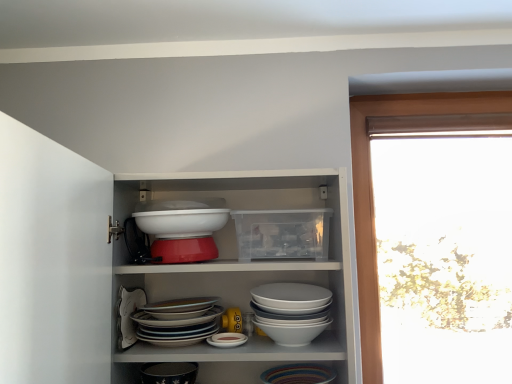
Question: Can you confirm if white glossy bowl at center, the 3th bowl in the top-to-bottom sequence, is positioned to the left of matte black bowl at lower center?

Choices:
 (A) no
 (B) yes

Answer: (A)

Question: From a real-world perspective, is white glossy bowl at center, the 3th bowl in the top-to-bottom sequence, under matte black bowl at lower center?

Choices:
 (A) no
 (B) yes

Answer: (A)

Question: Can you confirm if white glossy bowl at center, the 3th bowl in the top-to-bottom sequence, is shorter than matte black bowl at lower center?

Choices:
 (A) yes
 (B) no

Answer: (B)

Question: Does white glossy bowl at center, the 3th bowl in the top-to-bottom sequence, have a smaller size compared to matte black bowl at lower center?

Choices:
 (A) yes
 (B) no

Answer: (B)

Question: Is white glossy bowl at center, which ranks as the 1th bowl in bottom-to-top order, to the right of matte black bowl at lower center from the viewer's perspective?

Choices:
 (A) yes
 (B) no

Answer: (A)

Question: From the image's perspective, is white glossy bowl at center, which ranks as the 1th bowl in bottom-to-top order, positioned above or below white glossy bowl at center, which appears as the 3th bowl when ordered from the bottom?

Choices:
 (A) below
 (B) above

Answer: (A)

Question: Is point (222, 309) closer or farther from the camera than point (147, 223)?

Choices:
 (A) closer
 (B) farther

Answer: (B)

Question: From a real-world perspective, is white glossy bowl at center, the 3th bowl in the top-to-bottom sequence, above or below white glossy bowl at center, marked as the 1th bowl in a top-to-bottom arrangement?

Choices:
 (A) below
 (B) above

Answer: (A)

Question: Based on their positions, is white glossy bowl at center, which ranks as the 1th bowl in bottom-to-top order, located to the left or right of white glossy bowl at center, marked as the 1th bowl in a top-to-bottom arrangement?

Choices:
 (A) right
 (B) left

Answer: (B)

Question: Based on their positions, is white glossy bowls at center, the 2th bowl when ordered from top to bottom, located to the left or right of white glossy bowl at center, the 3th bowl in the top-to-bottom sequence?

Choices:
 (A) left
 (B) right

Answer: (B)

Question: Is white glossy bowls at center, acting as the 2th bowl starting from the bottom, inside or outside of white glossy bowl at center, the 3th bowl in the top-to-bottom sequence?

Choices:
 (A) outside
 (B) inside

Answer: (A)

Question: From a real-world perspective, is white glossy bowls at center, the 2th bowl when ordered from top to bottom, above or below white glossy bowl at center, the 3th bowl in the top-to-bottom sequence?

Choices:
 (A) above
 (B) below

Answer: (A)

Question: Considering their positions, is white glossy bowls at center, the 2th bowl when ordered from top to bottom, located in front of or behind white glossy bowl at center, which ranks as the 1th bowl in bottom-to-top order?

Choices:
 (A) front
 (B) behind

Answer: (A)

Question: From the image's perspective, is white glossy bowl at center, marked as the 1th bowl in a top-to-bottom arrangement, located above or below matte black bowl at lower center?

Choices:
 (A) below
 (B) above

Answer: (B)

Question: Considering their positions, is white glossy bowl at center, which appears as the 3th bowl when ordered from the bottom, located in front of or behind matte black bowl at lower center?

Choices:
 (A) behind
 (B) front

Answer: (B)